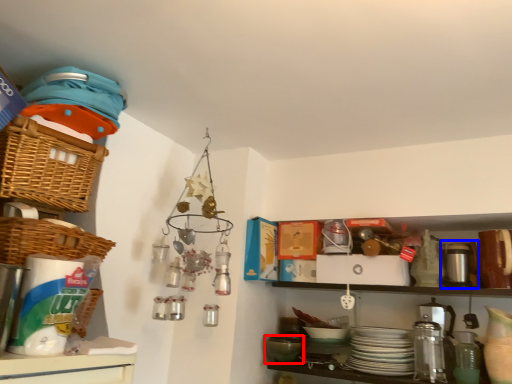
Question: Among these objects, which one is farthest to the camera, mixing bowl (highlighted by a red box) or appliance (highlighted by a blue box)?

Choices:
 (A) mixing bowl
 (B) appliance

Answer: (A)